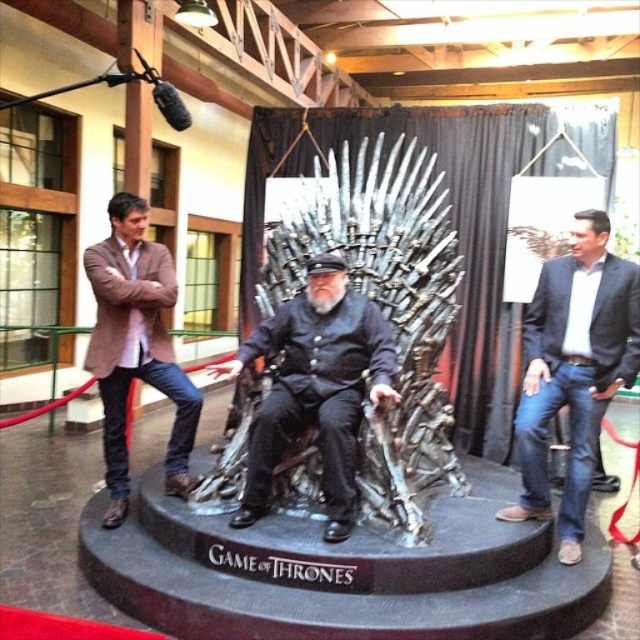
Question: Which of the following is the farthest from the observer?

Choices:
 (A) dark gray fabric coat at center
 (B) ironmetallicthrone at center
 (C) dark blue jeans at right

Answer: (C)

Question: Does ironmetallicthrone at center appear under dark blue jeans at right?

Choices:
 (A) yes
 (B) no

Answer: (B)

Question: Which point is closer to the camera taking this photo?

Choices:
 (A) (125, 500)
 (B) (588, 216)
 (C) (340, 358)
 (D) (316, 179)

Answer: (B)

Question: Considering the relative positions of ironmetallicthrone at center and dark gray fabric coat at center in the image provided, where is ironmetallicthrone at center located with respect to dark gray fabric coat at center?

Choices:
 (A) right
 (B) left

Answer: (A)

Question: Does dark blue jeans at right appear on the left side of dark gray fabric coat at center?

Choices:
 (A) no
 (B) yes

Answer: (A)

Question: Among these points, which one is farthest from the camera?

Choices:
 (A) (328, 355)
 (B) (592, 268)

Answer: (B)